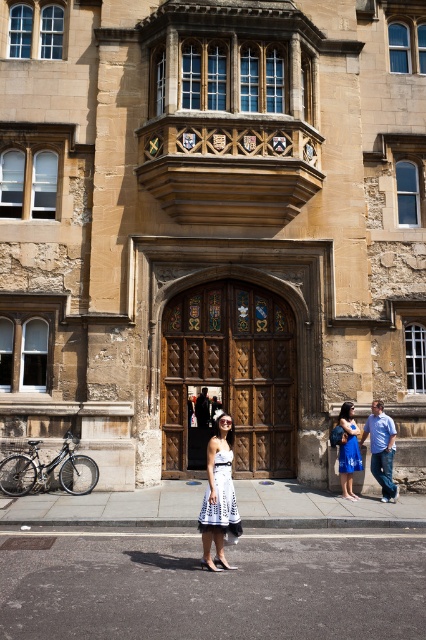
You are a delivery person who needs to enter the building through the wooden door at center. However, you are carrying a large package that is as tall as the blue denim jeans at lower right. Will the package fit through the door?

The wooden door at center has a greater height compared to blue denim jeans at lower right, so the package, being as tall as the blue denim jeans at lower right, will fit through the door since the door is taller.